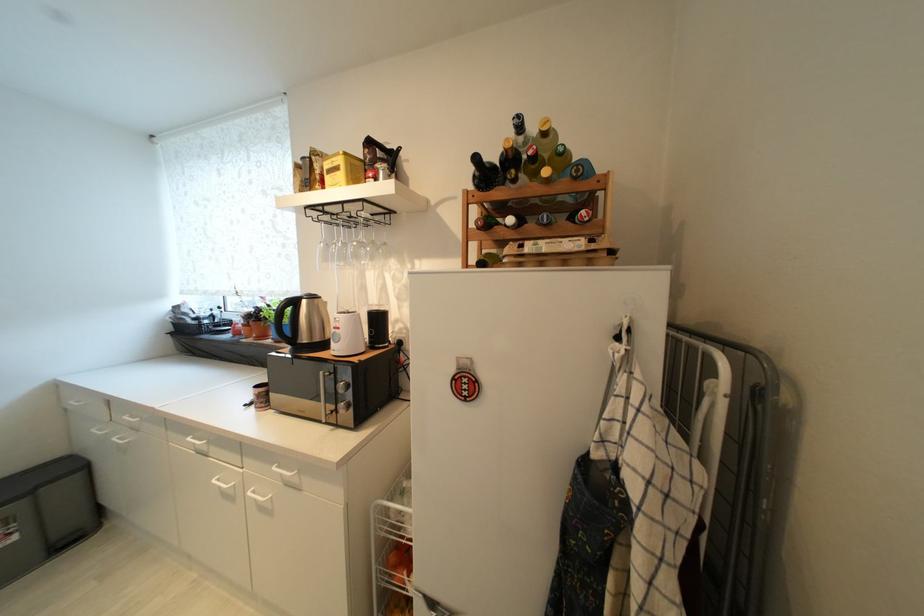
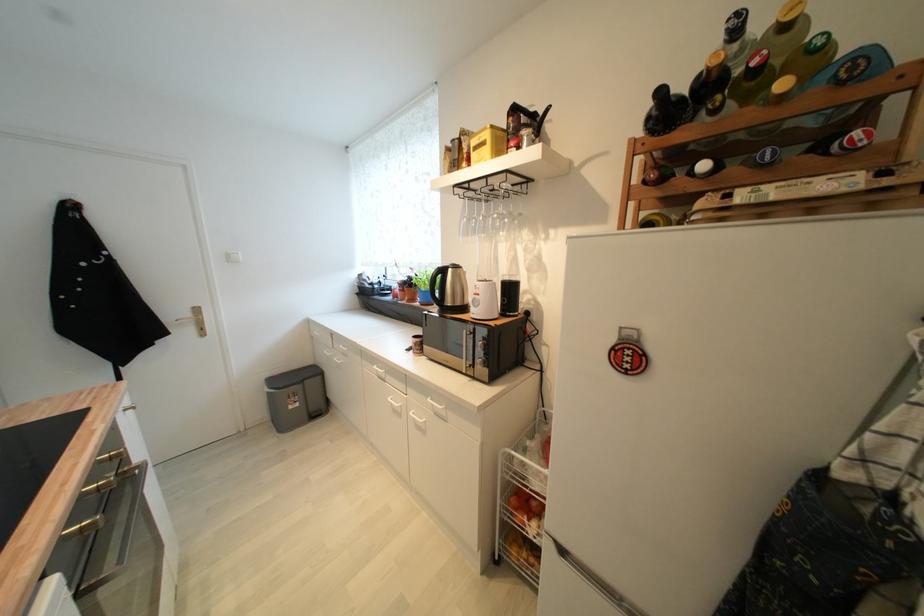
Where in the second image is the point corresponding to pixel 329 423 from the first image?

(469, 374)